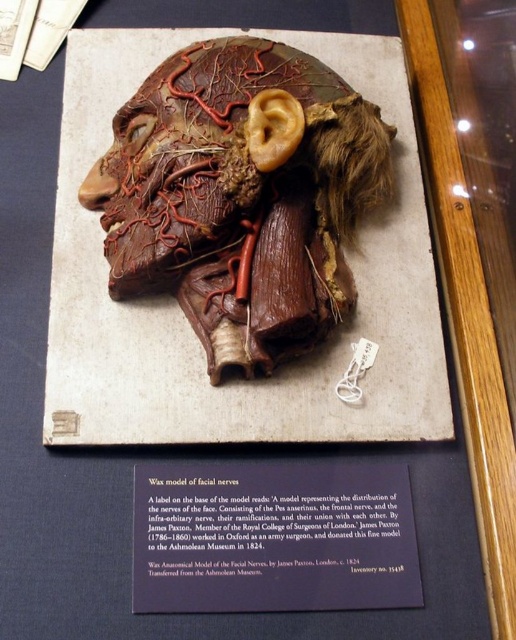
Is matte brown wax model of facial nerves at center thinner than purple paper at center?

No, matte brown wax model of facial nerves at center is not thinner than purple paper at center.

Is matte brown wax model of facial nerves at center above purple paper at center?

Yes, matte brown wax model of facial nerves at center is above purple paper at center.

Is point (315, 81) positioned before point (262, 522)?

No, it is not.

The height and width of the screenshot is (640, 516). In order to click on matte brown wax model of facial nerves at center in this screenshot , I will do `click(239, 198)`.